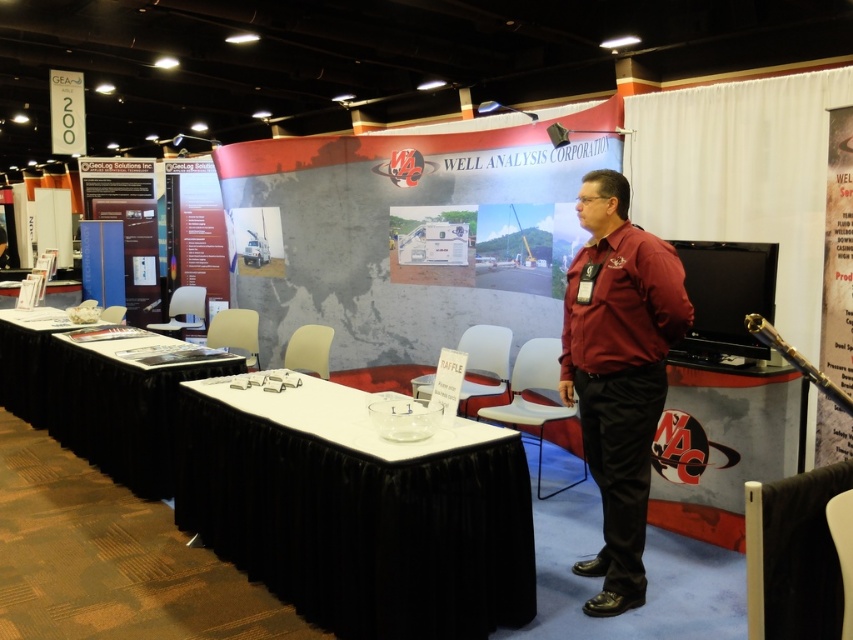
Question: Is white glossy table at center to the right of maroon shirt at center from the viewer's perspective?

Choices:
 (A) no
 (B) yes

Answer: (A)

Question: Among these points, which one is nearest to the camera?

Choices:
 (A) (496, 588)
 (B) (111, 476)

Answer: (A)

Question: Which object appears farthest from the camera in this image?

Choices:
 (A) maroon shirt at center
 (B) white glossy table at center
 (C) black fabric table at lower left

Answer: (C)

Question: Is white glossy table at center to the left of maroon shirt at center from the viewer's perspective?

Choices:
 (A) no
 (B) yes

Answer: (B)

Question: Which is farther from the maroon shirt at center?

Choices:
 (A) white glossy table at center
 (B) black fabric table at lower left

Answer: (B)

Question: Is maroon shirt at center smaller than black fabric table at lower left?

Choices:
 (A) no
 (B) yes

Answer: (B)